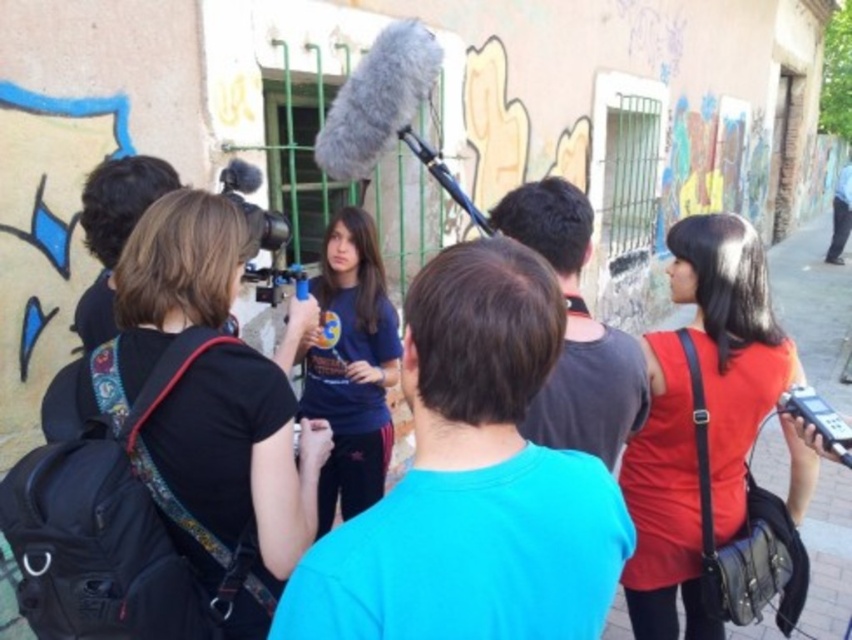
Question: Is matte black backpack at center above matte blue t-shirt at center?

Choices:
 (A) yes
 (B) no

Answer: (A)

Question: Which of these objects is positioned farthest from the matte blue t-shirt at center?

Choices:
 (A) matte black backpack at center
 (B) matte red dress at center

Answer: (B)

Question: Is matte red dress at center bigger than matte blue t-shirt at center?

Choices:
 (A) yes
 (B) no

Answer: (B)

Question: Which object appears closest to the camera in this image?

Choices:
 (A) matte blue t-shirt at center
 (B) matte black backpack at center

Answer: (B)

Question: Which object is the closest to the matte black video camera at center?

Choices:
 (A) matte red dress at center
 (B) matte black backpack at center

Answer: (B)

Question: Is the position of matte black backpack at center more distant than that of matte black video camera at center?

Choices:
 (A) no
 (B) yes

Answer: (A)